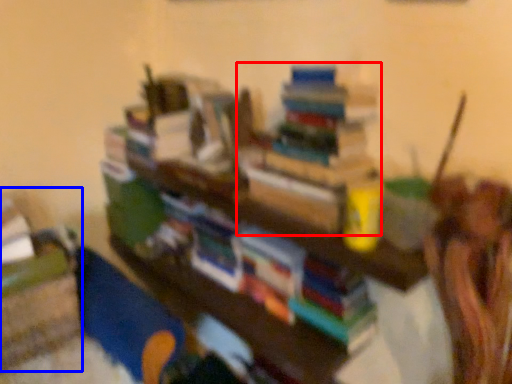
Question: Which object is further to the camera taking this photo, book (highlighted by a red box) or shelf (highlighted by a blue box)?

Choices:
 (A) book
 (B) shelf

Answer: (B)